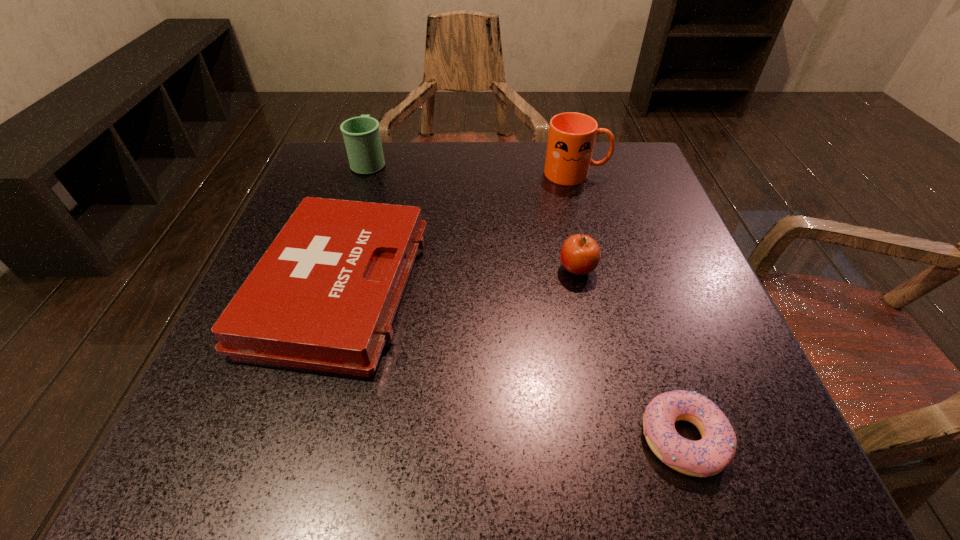
This screenshot has width=960, height=540. Find the location of `object that is positioned at the near edge`. object that is positioned at the near edge is located at coordinates (709, 456).

Identify the location of mug present at the left edge. The height and width of the screenshot is (540, 960). (361, 134).

Where is `the first-aid kit positioned at the left edge`? the first-aid kit positioned at the left edge is located at coordinates (324, 295).

At what (x,y) coordinates should I click in order to perform the action: click on mug positioned at the right edge. Please return your answer as a coordinate pair (x, y). This screenshot has width=960, height=540. Looking at the image, I should click on (571, 138).

Image resolution: width=960 pixels, height=540 pixels. In order to click on doughnut that is at the right edge in this screenshot , I will do `click(709, 456)`.

Where is `object that is at the far left corner`? This screenshot has height=540, width=960. object that is at the far left corner is located at coordinates (361, 134).

The image size is (960, 540). Identify the location of object that is positioned at the far right corner. (571, 138).

Locate an element on the screen. This screenshot has width=960, height=540. object that is at the near right corner is located at coordinates (709, 456).

At what (x,y) coordinates should I click in order to perform the action: click on vacant space at the far edge. Please return your answer as a coordinate pair (x, y). This screenshot has width=960, height=540. Looking at the image, I should click on (480, 183).

The image size is (960, 540). In order to click on free space at the near edge of the desktop in this screenshot , I will do (x=546, y=443).